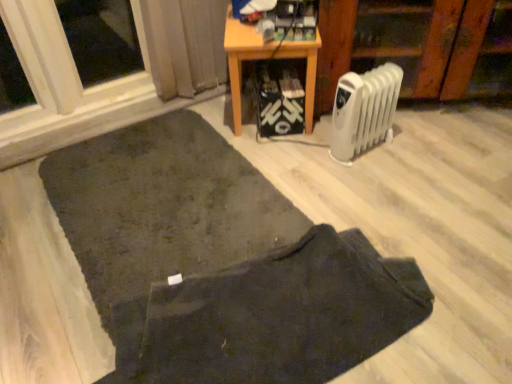
Question: Is dark fabric doormat at lower center with white plastic radiator at lower right?

Choices:
 (A) no
 (B) yes

Answer: (A)

Question: Can you confirm if dark fabric doormat at lower center is thinner than white plastic radiator at lower right?

Choices:
 (A) yes
 (B) no

Answer: (B)

Question: From a real-world perspective, is dark fabric doormat at lower center below white plastic radiator at lower right?

Choices:
 (A) yes
 (B) no

Answer: (A)

Question: Are dark fabric doormat at lower center and white plastic radiator at lower right far apart?

Choices:
 (A) no
 (B) yes

Answer: (A)

Question: Is dark fabric doormat at lower center to the left of white plastic radiator at lower right from the viewer's perspective?

Choices:
 (A) yes
 (B) no

Answer: (A)

Question: From the image's perspective, does dark fabric doormat at lower center appear lower than white plastic radiator at lower right?

Choices:
 (A) no
 (B) yes

Answer: (B)

Question: Considering the relative sizes of white plastic radiator at lower right and dark fabric mat at lower center in the image provided, is white plastic radiator at lower right smaller than dark fabric mat at lower center?

Choices:
 (A) no
 (B) yes

Answer: (B)

Question: Is white plastic radiator at lower right beside dark fabric mat at lower center?

Choices:
 (A) no
 (B) yes

Answer: (A)

Question: From a real-world perspective, is white plastic radiator at lower right located higher than dark fabric mat at lower center?

Choices:
 (A) yes
 (B) no

Answer: (A)

Question: Does white plastic radiator at lower right have a lesser height compared to dark fabric mat at lower center?

Choices:
 (A) no
 (B) yes

Answer: (A)

Question: Considering the relative sizes of white plastic radiator at lower right and dark fabric mat at lower center in the image provided, is white plastic radiator at lower right bigger than dark fabric mat at lower center?

Choices:
 (A) yes
 (B) no

Answer: (B)

Question: Is white plastic radiator at lower right not inside dark fabric mat at lower center?

Choices:
 (A) yes
 (B) no

Answer: (A)

Question: Is white plastic radiator at lower right shorter than dark fabric doormat at lower center?

Choices:
 (A) yes
 (B) no

Answer: (B)